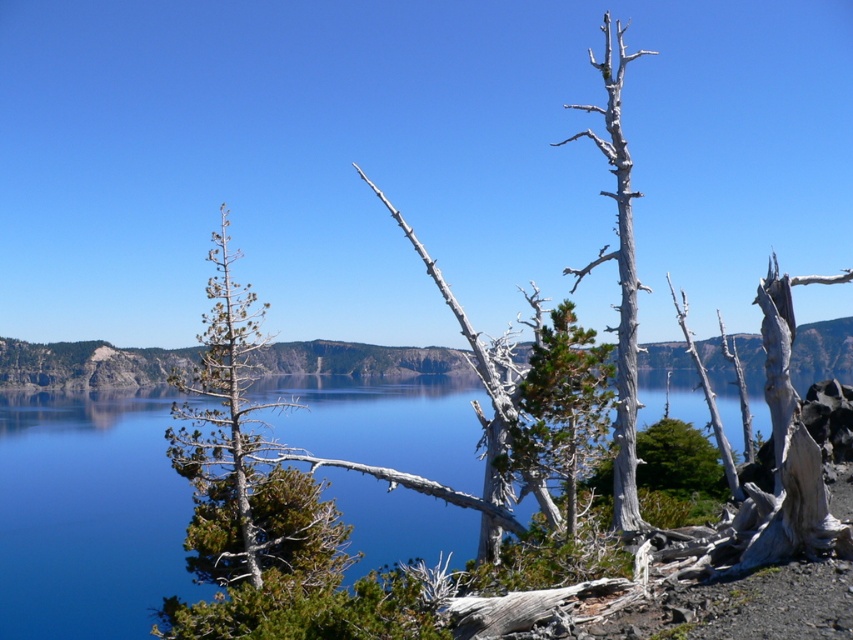
Question: Estimate the real-world distances between objects in this image. Which object is closer to the blue glassy water at center?

Choices:
 (A) gray bark tree at upper center
 (B) green matte tree at center
 (C) green textured pine tree at left

Answer: (A)

Question: Does blue glassy water at center lie in front of green textured pine tree at left?

Choices:
 (A) no
 (B) yes

Answer: (B)

Question: Is green matte tree at center smaller than gray bark tree at upper center?

Choices:
 (A) yes
 (B) no

Answer: (A)

Question: Is green matte tree at center further to the viewer compared to gray bark tree at upper center?

Choices:
 (A) no
 (B) yes

Answer: (A)

Question: Which point is closer to the camera?

Choices:
 (A) green matte tree at center
 (B) green textured pine tree at left
 (C) gray bark tree at upper center

Answer: (A)

Question: Which point is closer to the camera?

Choices:
 (A) green matte tree at center
 (B) green textured pine tree at left
 (C) blue glassy water at center
 (D) gray bark tree at upper center

Answer: (C)